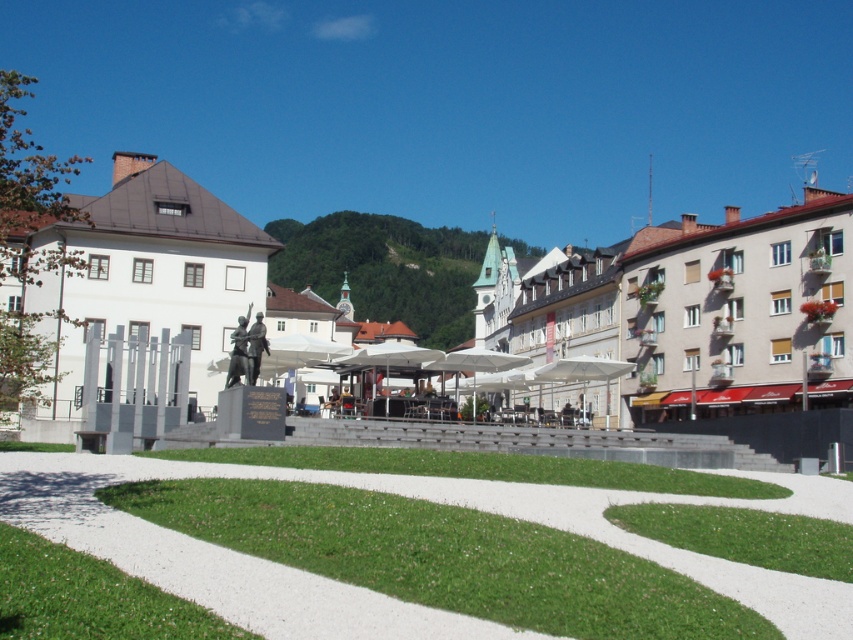
Question: Considering the relative positions of polished stone statue at center and bronze statue at center in the image provided, where is polished stone statue at center located with respect to bronze statue at center?

Choices:
 (A) left
 (B) right

Answer: (B)

Question: Does polished stone statue at center lie behind bronze statue at center?

Choices:
 (A) no
 (B) yes

Answer: (B)

Question: Which of the following is the farthest from the observer?

Choices:
 (A) bronze statue at center
 (B) green grass at center
 (C) polished stone statue at center

Answer: (C)

Question: Which of these objects is positioned farthest from the bronze statue at center?

Choices:
 (A) green grass at center
 (B) polished stone statue at center

Answer: (B)

Question: Considering the real-world distances, which object is farthest from the polished stone statue at center?

Choices:
 (A) bronze statue at center
 (B) green grass at center

Answer: (A)

Question: Can you confirm if polished stone statue at center is smaller than bronze statue at center?

Choices:
 (A) yes
 (B) no

Answer: (B)